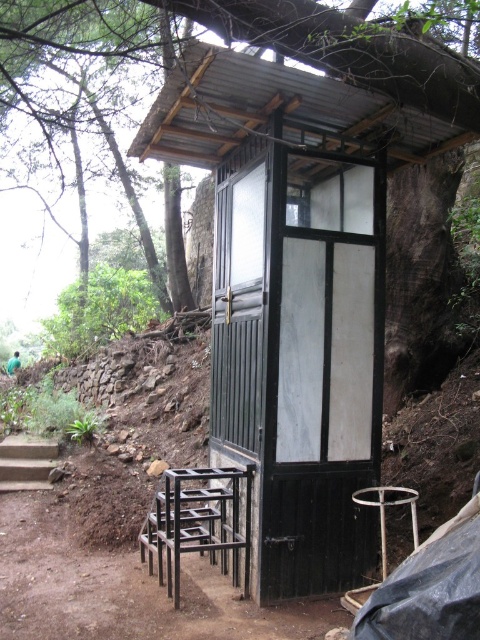
You are standing in front of the rustic outdoor structure and need to place a new bench that is 1 meter wide. The bench must be placed either next to the black metal stool at lower left or the concrete stairs at lower left. Based on their widths, which location can accommodate the bench?

The black metal stool at lower left has a larger width than the concrete stairs at lower left. Therefore, the bench that is 1 meter wide can be placed next to the black metal stool at lower left if its width is sufficient. However, without knowing the exact width of the stool, it is uncertain. The answer provided here assumes the stool is wider than the stairs but does not confirm it can fit the bench.

You are standing at the center of the image. Where is the black metal stool at lower left located relative to your position?

The black metal stool at lower left is located at point (196,522) relative to the center of the image.